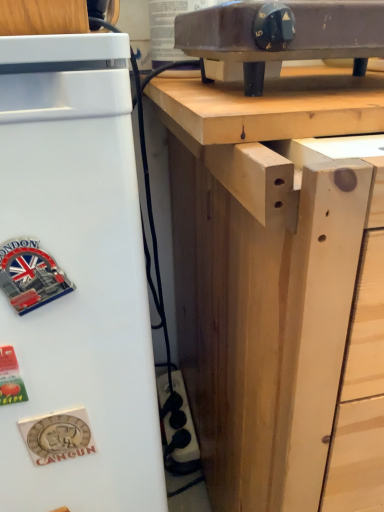
Question: From the image's perspective, relative to matte black electric stove at upper center, is natural wood table at upper center above or below?

Choices:
 (A) below
 (B) above

Answer: (A)

Question: Looking at their shapes, would you say natural wood table at upper center is wider or thinner than matte black electric stove at upper center?

Choices:
 (A) thin
 (B) wide

Answer: (B)

Question: Which object is the closest to the natural wood desk at upper center?

Choices:
 (A) natural wood table at upper center
 (B) white matte refrigerator at left
 (C) matte black electric stove at upper center

Answer: (A)

Question: Which object is positioned farthest from the natural wood table at upper center?

Choices:
 (A) white matte refrigerator at left
 (B) natural wood desk at upper center
 (C) matte black electric stove at upper center

Answer: (A)